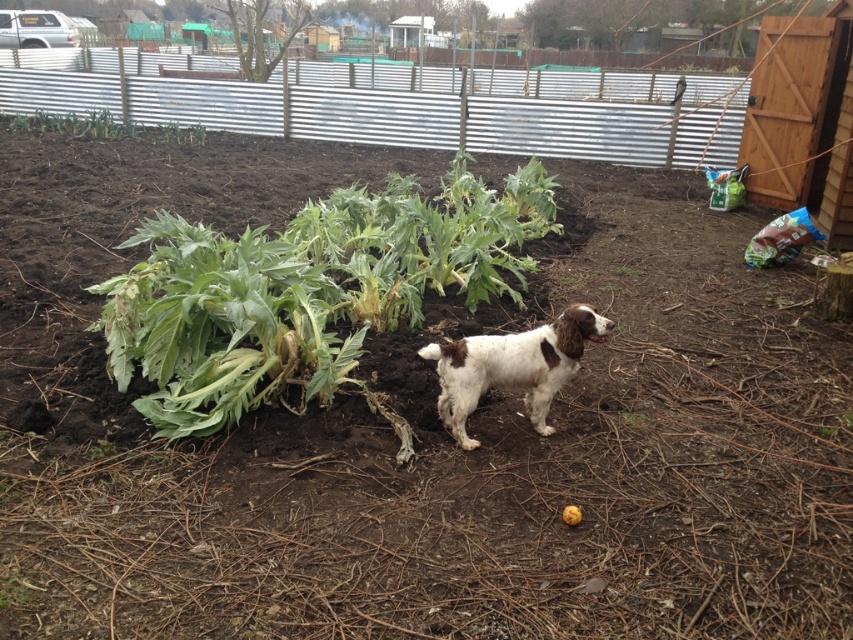
Is point (572, 307) positioned before point (12, 120)?

Yes, it is in front of point (12, 120).

Is white fur dog at center positioned behind green leafy plant at upper left?

No, white fur dog at center is closer to the viewer.

Who is more forward, (461, 371) or (154, 132)?

Positioned in front is point (461, 371).

This screenshot has width=853, height=640. Find the location of `white fur dog at center`. white fur dog at center is located at coordinates (512, 365).

Is green leafy plant at center to the left of white fur dog at center from the viewer's perspective?

Correct, you'll find green leafy plant at center to the left of white fur dog at center.

Between green leafy plant at center and white fur dog at center, which one has less height?

white fur dog at center

Where is `green leafy plant at center`? Image resolution: width=853 pixels, height=640 pixels. green leafy plant at center is located at coordinates (306, 291).

The height and width of the screenshot is (640, 853). Describe the element at coordinates (306, 291) in the screenshot. I see `green leafy plant at center` at that location.

Does green leafy plant at center have a lesser height compared to green leafy plant at upper left?

Result: No.

Locate an element on the screen. green leafy plant at center is located at coordinates (306, 291).